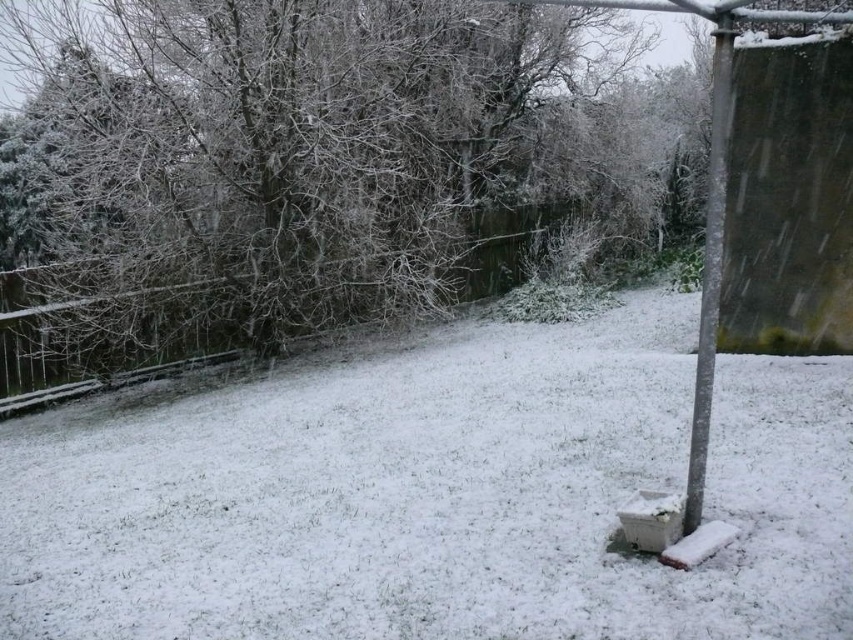
Which is behind, point (519, 280) or point (724, 42)?

Positioned behind is point (519, 280).

Which is more to the right, wooden at left or metallic pole at right?

Positioned to the right is metallic pole at right.

Find the location of a particular element. This screenshot has width=853, height=640. wooden at left is located at coordinates (503, 244).

Where is `wooden at left`? This screenshot has height=640, width=853. wooden at left is located at coordinates pyautogui.click(x=503, y=244).

Can you confirm if snow-covered branches at upper left is wider than wooden at left?

Indeed, snow-covered branches at upper left has a greater width compared to wooden at left.

Who is lower down, snow-covered branches at upper left or wooden at left?

wooden at left is below.

Locate an element on the screen. snow-covered branches at upper left is located at coordinates (294, 131).

Which is more to the right, snow-covered branches at upper left or metallic pole at right?

Positioned to the right is metallic pole at right.

Does snow-covered branches at upper left have a greater height compared to metallic pole at right?

No.

This screenshot has height=640, width=853. What do you see at coordinates (294, 131) in the screenshot?
I see `snow-covered branches at upper left` at bounding box center [294, 131].

What are the coordinates of `snow-covered branches at upper left` in the screenshot? It's located at (294, 131).